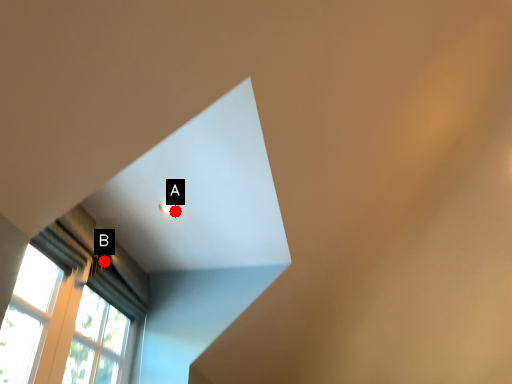
Question: Two points are circled on the image, labeled by A and B beside each circle. Which point is further to the camera?

Choices:
 (A) A is further
 (B) B is further

Answer: (B)